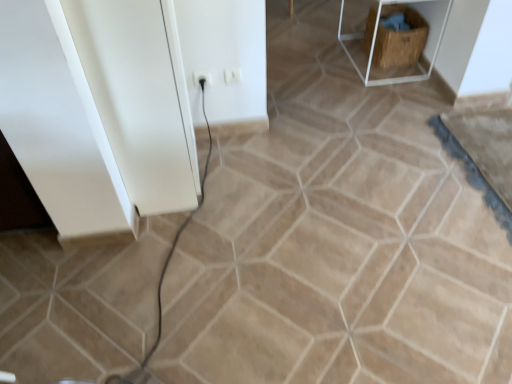
Question: From the image's perspective, is wooden crate at upper right located beneath white plastic electric outlet at center, which is the second electric outlet in left-to-right order?

Choices:
 (A) yes
 (B) no

Answer: (B)

Question: Is the depth of wooden crate at upper right greater than that of white plastic electric outlet at center, which is the second electric outlet in left-to-right order?

Choices:
 (A) no
 (B) yes

Answer: (B)

Question: Considering the relative sizes of wooden crate at upper right and white plastic electric outlet at center, marked as the 1th electric outlet in a right-to-left arrangement, in the image provided, is wooden crate at upper right taller than white plastic electric outlet at center, marked as the 1th electric outlet in a right-to-left arrangement,?

Choices:
 (A) yes
 (B) no

Answer: (A)

Question: From a real-world perspective, is wooden crate at upper right positioned under white plastic electric outlet at center, marked as the 1th electric outlet in a right-to-left arrangement, based on gravity?

Choices:
 (A) no
 (B) yes

Answer: (B)

Question: Would you say wooden crate at upper right is outside white plastic electric outlet at center, marked as the 1th electric outlet in a right-to-left arrangement?

Choices:
 (A) yes
 (B) no

Answer: (A)

Question: From a real-world perspective, is white glossy cabinet at left physically located above or below white plastic electric outlet at center, marked as the 1th electric outlet in a right-to-left arrangement?

Choices:
 (A) below
 (B) above

Answer: (B)

Question: From the image's perspective, is white glossy cabinet at left located above or below white plastic electric outlet at center, marked as the 1th electric outlet in a right-to-left arrangement?

Choices:
 (A) below
 (B) above

Answer: (A)

Question: From their relative heights in the image, would you say white glossy cabinet at left is taller or shorter than white plastic electric outlet at center, which is the second electric outlet in left-to-right order?

Choices:
 (A) tall
 (B) short

Answer: (A)

Question: Is white glossy cabinet at left spatially inside white plastic electric outlet at center, marked as the 1th electric outlet in a right-to-left arrangement, or outside of it?

Choices:
 (A) outside
 (B) inside

Answer: (A)

Question: From their relative heights in the image, would you say white plastic electric outlet at center, marked as the 1th electric outlet in a right-to-left arrangement, is taller or shorter than brown woven crate at upper right?

Choices:
 (A) short
 (B) tall

Answer: (A)

Question: Looking at the image, does white plastic electric outlet at center, which is the second electric outlet in left-to-right order, seem bigger or smaller compared to brown woven crate at upper right?

Choices:
 (A) big
 (B) small

Answer: (B)

Question: Relative to brown woven crate at upper right, is white plastic electric outlet at center, which is the second electric outlet in left-to-right order, in front or behind?

Choices:
 (A) front
 (B) behind

Answer: (A)

Question: Does point (236, 82) appear closer or farther from the camera than point (394, 64)?

Choices:
 (A) farther
 (B) closer

Answer: (B)

Question: Is wooden crate at upper right to the left or to the right of white plastic electric outlet at center, the first electric outlet in the left-to-right sequence, in the image?

Choices:
 (A) left
 (B) right

Answer: (B)

Question: Considering the positions of wooden crate at upper right and white plastic electric outlet at center, the 2th electric outlet positioned from the right, in the image, is wooden crate at upper right bigger or smaller than white plastic electric outlet at center, the 2th electric outlet positioned from the right,?

Choices:
 (A) big
 (B) small

Answer: (A)